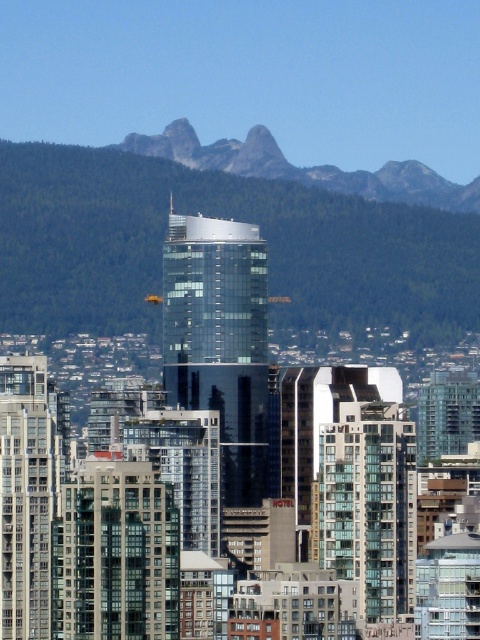
Question: Can you confirm if green forested mountain at upper center is positioned above gray rocky mountain at upper center?

Choices:
 (A) no
 (B) yes

Answer: (A)

Question: Is green forested mountain at upper center to the right of gray rocky mountain at upper center from the viewer's perspective?

Choices:
 (A) yes
 (B) no

Answer: (B)

Question: Does green forested mountain at upper center appear under gray rocky mountain at upper center?

Choices:
 (A) yes
 (B) no

Answer: (A)

Question: Which point is farther from the camera taking this photo?

Choices:
 (A) click(x=430, y=301)
 (B) click(x=432, y=189)

Answer: (B)

Question: Among these points, which one is nearest to the camera?

Choices:
 (A) coord(389,195)
 (B) coord(343,253)

Answer: (B)